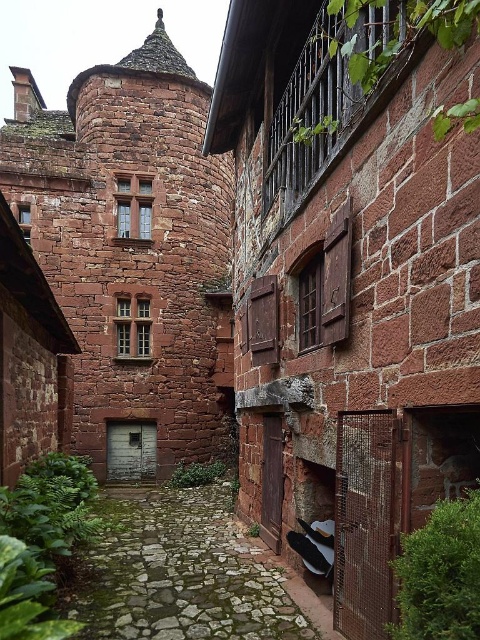
Question: Which object is farther from the camera taking this photo?

Choices:
 (A) green mossy stone path at lower center
 (B) rustic stone castle at center

Answer: (B)

Question: Observing the image, what is the correct spatial positioning of rustic stone castle at center in reference to green mossy stone path at lower center?

Choices:
 (A) below
 (B) above

Answer: (B)

Question: Does rustic stone castle at center come behind green mossy stone path at lower center?

Choices:
 (A) no
 (B) yes

Answer: (B)

Question: Which of the following is the farthest from the observer?

Choices:
 (A) green mossy stone path at lower center
 (B) rustic stone castle at center

Answer: (B)

Question: In this image, where is rustic stone castle at center located relative to green mossy stone path at lower center?

Choices:
 (A) below
 (B) above

Answer: (B)